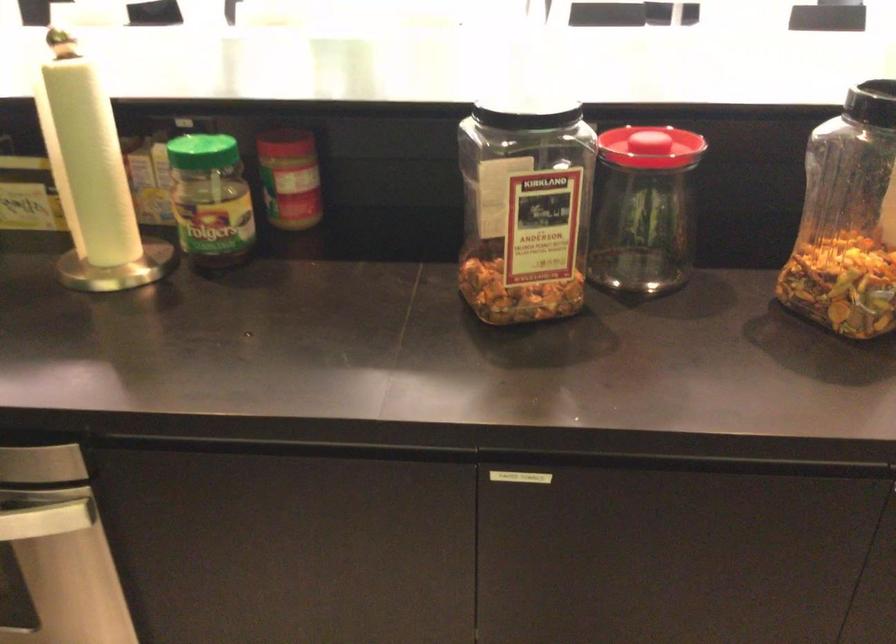
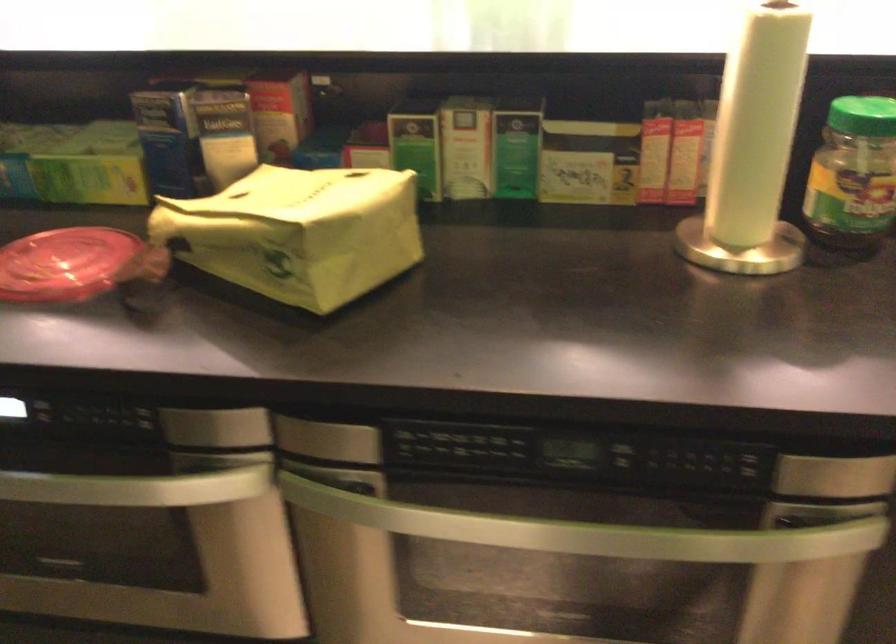
Question: The camera is either moving clockwise (left) or counter-clockwise (right) around the object. The first image is from the beginning of the video and the second image is from the end. Is the camera moving left or right when shooting the video?

Choices:
 (A) Left
 (B) Right

Answer: (B)